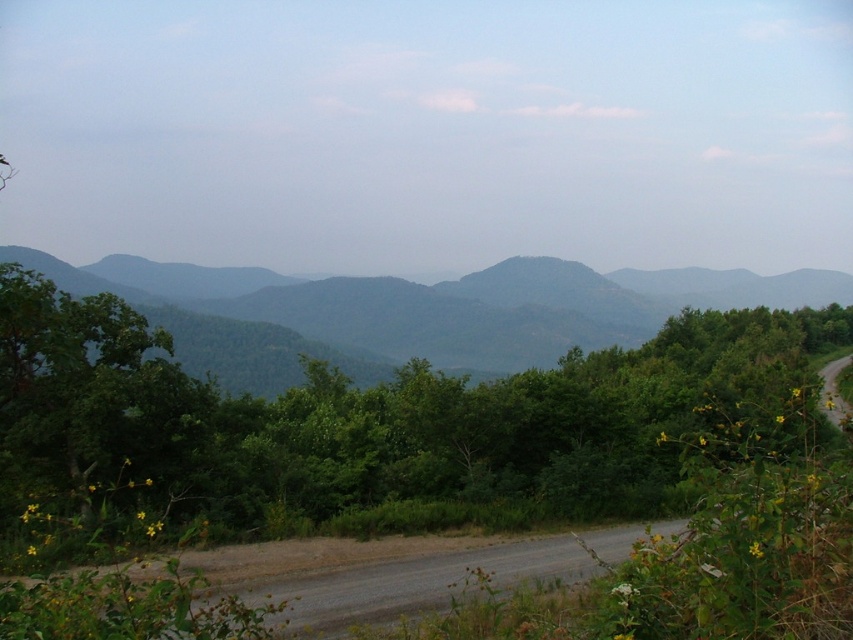
You are standing at the edge of the dirt road and see the green leafy tree at center and the green forested mountain at center. Which object is closer to the ground?

The green leafy tree at center is closer to the ground because it is positioned below the green forested mountain at center.

You are planning to take a photo of the green leafy tree at center and the green forested mountain at center. Which object will appear narrower in your photo?

The green leafy tree at center will appear narrower in the photo because it is thinner than the green forested mountain at center.